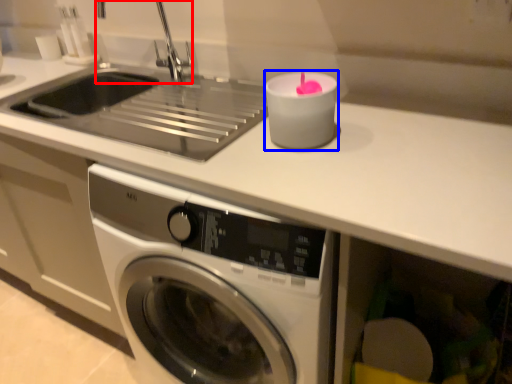
Question: Which of the following is the farthest to the observer, faucet (highlighted by a red box) or candle holder (highlighted by a blue box)?

Choices:
 (A) faucet
 (B) candle holder

Answer: (A)